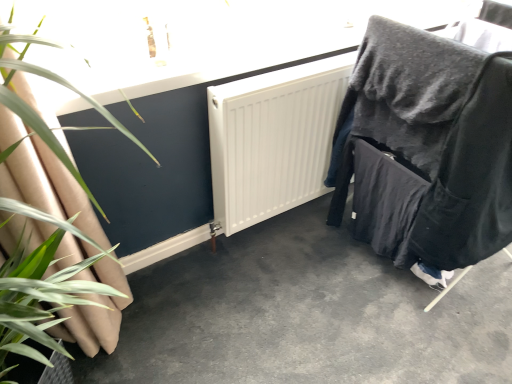
Where is `free space in front of velvet black chair at right`? The width and height of the screenshot is (512, 384). free space in front of velvet black chair at right is located at coordinates (411, 343).